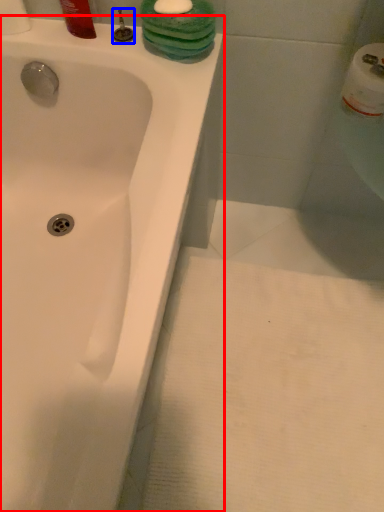
Question: Which of the following is the farthest to the observer, bathtub (highlighted by a red box) or plumbing fixture (highlighted by a blue box)?

Choices:
 (A) bathtub
 (B) plumbing fixture

Answer: (B)